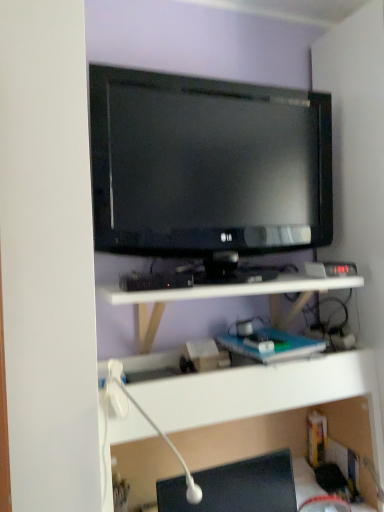
Question: Can you confirm if white plastic lamp at lower center is shorter than white matte shelf at center, which is counted as the first shelf, starting from the top?

Choices:
 (A) no
 (B) yes

Answer: (A)

Question: From a real-world perspective, is white plastic lamp at lower center under white matte shelf at center, which is the second shelf in bottom-to-top order?

Choices:
 (A) yes
 (B) no

Answer: (A)

Question: Could white matte shelf at center, which is counted as the first shelf, starting from the top, be considered to be inside white plastic lamp at lower center?

Choices:
 (A) no
 (B) yes

Answer: (A)

Question: From the image's perspective, is white plastic lamp at lower center under white matte shelf at center, which is counted as the first shelf, starting from the top?

Choices:
 (A) yes
 (B) no

Answer: (A)

Question: From the image's perspective, is white plastic lamp at lower center located above white matte shelf at center, which is the second shelf in bottom-to-top order?

Choices:
 (A) yes
 (B) no

Answer: (B)

Question: Considering the relative positions of white plastic lamp at lower center and white matte shelf at center, which is counted as the first shelf, starting from the top, in the image provided, is white plastic lamp at lower center in front of white matte shelf at center, which is counted as the first shelf, starting from the top,?

Choices:
 (A) yes
 (B) no

Answer: (A)

Question: Is black glossy desktop at lower right positioned before white matte shelf at center, which is counted as the first shelf, starting from the top?

Choices:
 (A) yes
 (B) no

Answer: (A)

Question: Is black glossy desktop at lower right taller than white matte shelf at center, which is the second shelf in bottom-to-top order?

Choices:
 (A) no
 (B) yes

Answer: (A)

Question: Is black glossy desktop at lower right positioned with its back to white matte shelf at center, which is the second shelf in bottom-to-top order?

Choices:
 (A) yes
 (B) no

Answer: (B)

Question: Considering the relative positions of black glossy desktop at lower right and white matte shelf at center, which is the second shelf in bottom-to-top order, in the image provided, is black glossy desktop at lower right to the left of white matte shelf at center, which is the second shelf in bottom-to-top order, from the viewer's perspective?

Choices:
 (A) no
 (B) yes

Answer: (A)

Question: From the image's perspective, is black glossy desktop at lower right above white matte shelf at center, which is counted as the first shelf, starting from the top?

Choices:
 (A) yes
 (B) no

Answer: (B)

Question: Is black glossy desktop at lower right next to white matte shelf at center, which is counted as the first shelf, starting from the top, and touching it?

Choices:
 (A) no
 (B) yes

Answer: (A)

Question: Is white plastic shelf at lower center, the 1th shelf in the bottom-to-top sequence, at the left side of matte black tv at upper center?

Choices:
 (A) yes
 (B) no

Answer: (B)